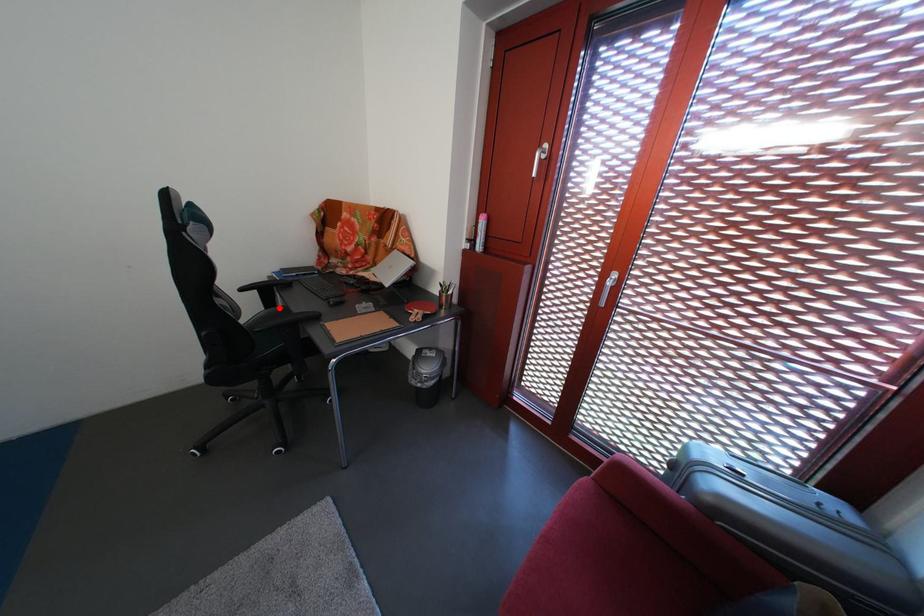
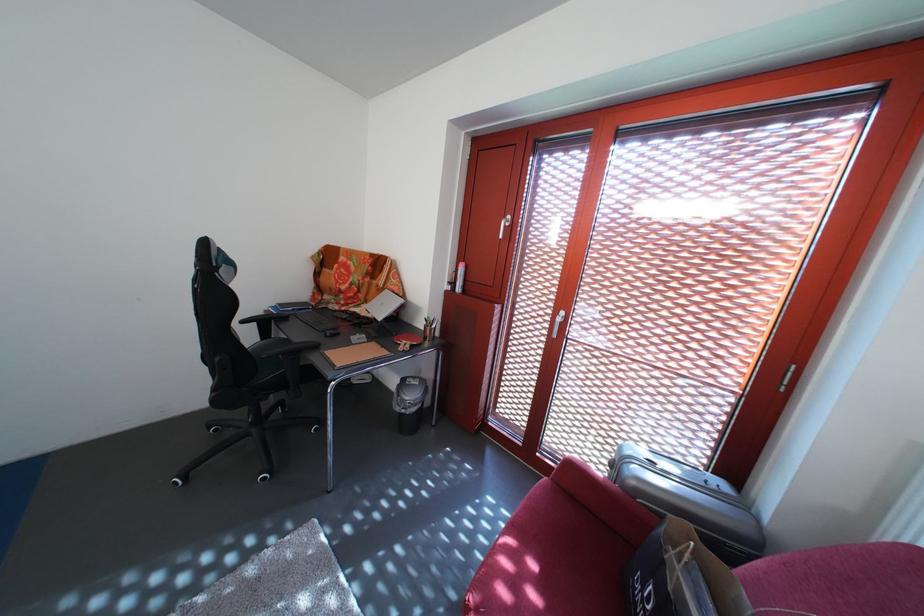
Locate, in the second image, the point that corresponds to the highlighted location in the first image.

(275, 339)